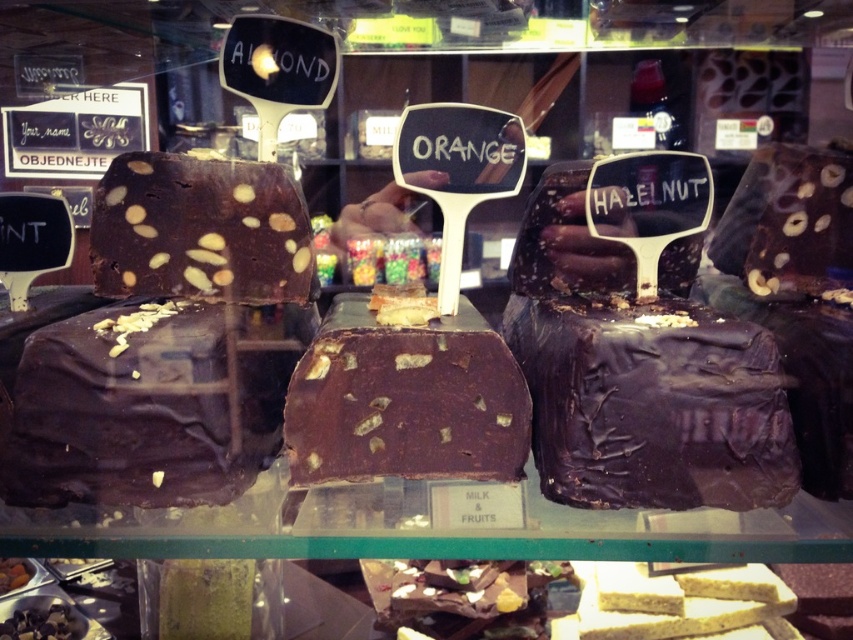
You are a customer looking at the display case in the bakery. There are two points marked in the case. The first point is at coordinate (91, 364) and the second is at (409, 403). Which point is closer to you as you look at the display?

Point (91, 364) is closer to the viewer than point (409, 403).

You are a customer in the bakery and want to buy the shiny dark chocolate cake at center and the shiny dark chocolate at center. If you look down from the top of the display case, which one is positioned lower?

The shiny dark chocolate cake at center is located below the shiny dark chocolate at center, so when looking down from the top of the display case, the shiny dark chocolate cake at center is positioned lower.

You are a customer in the bakery and want to find the shiny dark chocolate cake at left. According to the display case layout, where should you look relative to the other items?

The shiny dark chocolate cake at left is located at point (151, 403), which is on the left side of the display case.